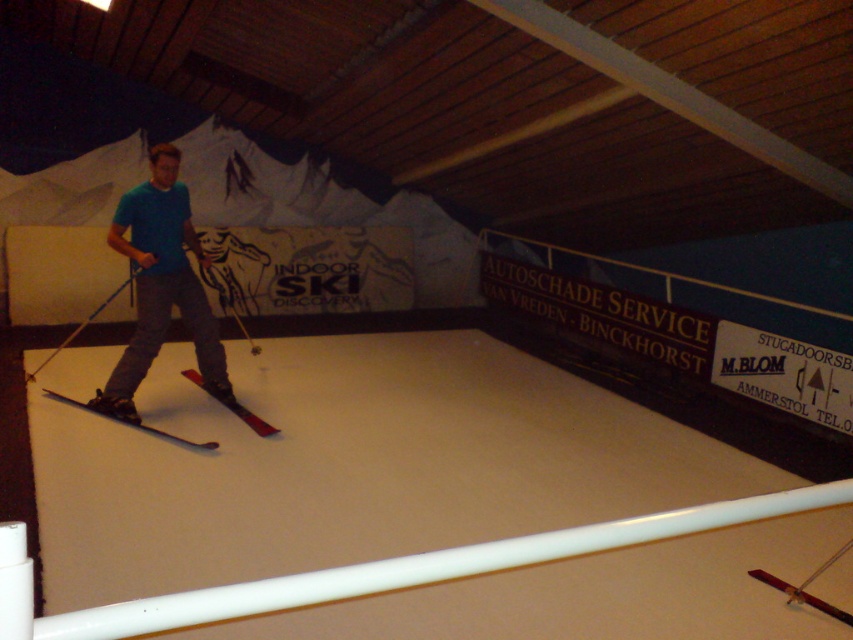
Question: Observing the image, what is the correct spatial positioning of red matte ski at center in reference to blue plastic ski pole at center?

Choices:
 (A) below
 (B) above

Answer: (A)

Question: Can you confirm if shiny black ski at center is smaller than blue plastic ski pole at center?

Choices:
 (A) yes
 (B) no

Answer: (A)

Question: Which of the following is the farthest from the observer?

Choices:
 (A) blue plastic ski pole at center
 (B) red matte ski at center
 (C) shiny black ski at center

Answer: (A)

Question: Which of the following is the closest to the observer?

Choices:
 (A) (138, 269)
 (B) (206, 257)

Answer: (A)

Question: Does blue matte/solid shirt at center appear under red matte ski at center?

Choices:
 (A) yes
 (B) no

Answer: (B)

Question: Which point is farther to the camera?

Choices:
 (A) (265, 429)
 (B) (111, 241)

Answer: (B)